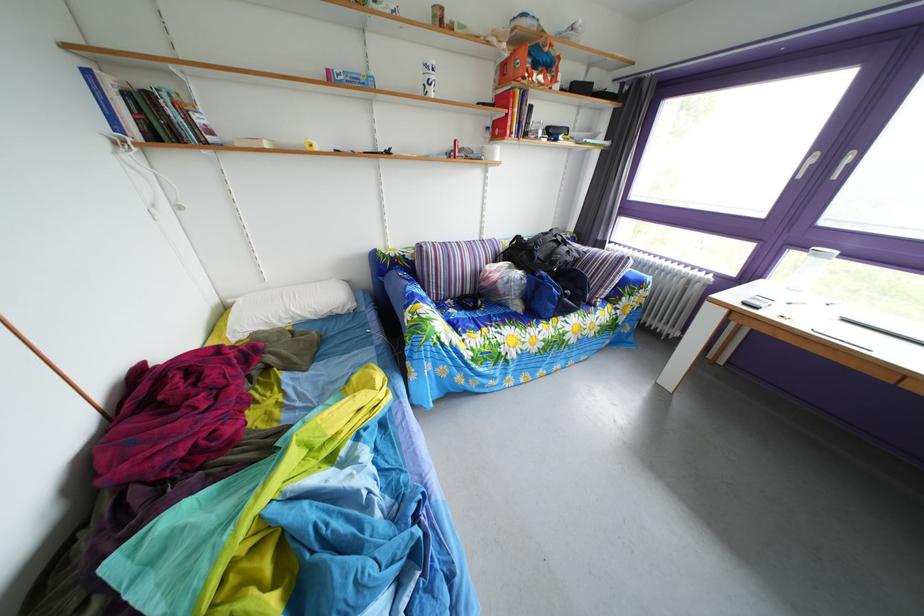
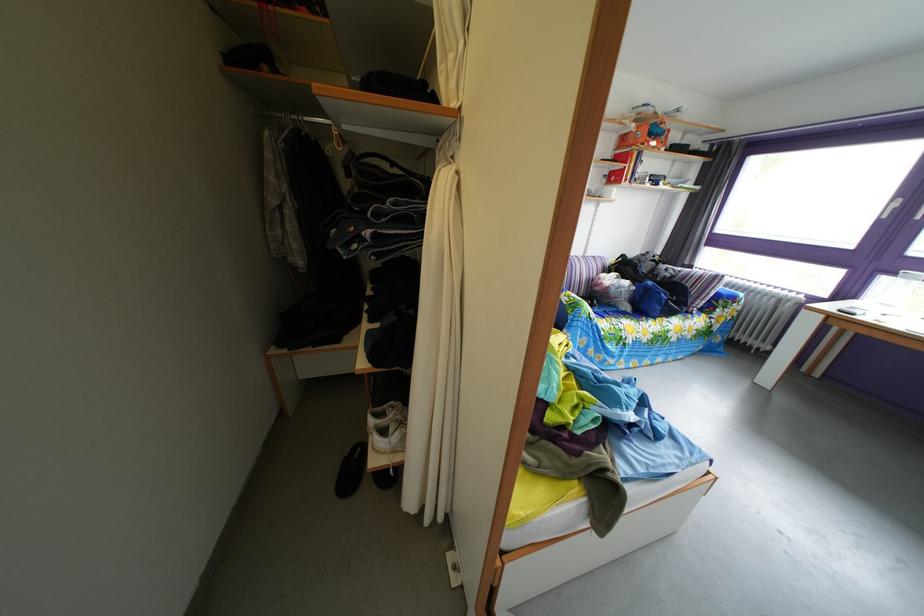
Find the pixel in the second image that matches the point at 553,282 in the first image.

(661, 291)